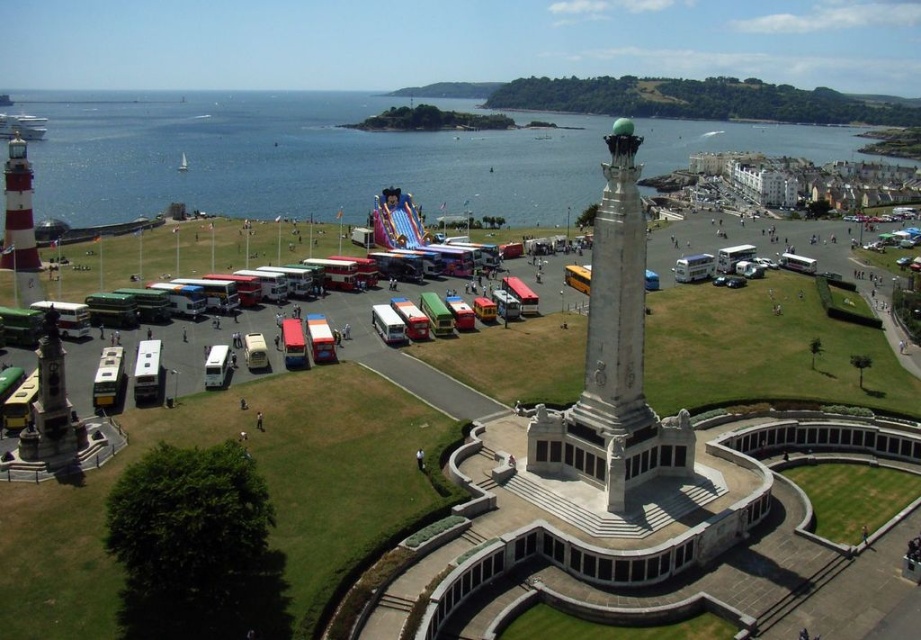
Question: Is white marble monument at center positioned behind polished stone monument at lower left?

Choices:
 (A) yes
 (B) no

Answer: (B)

Question: Does blue water at upper center have a greater width compared to white painted lighthouse at left?

Choices:
 (A) no
 (B) yes

Answer: (B)

Question: Is blue water at upper center in front of polished stone monument at lower left?

Choices:
 (A) no
 (B) yes

Answer: (A)

Question: Among these objects, which one is farthest from the camera?

Choices:
 (A) white painted lighthouse at left
 (B) blue water at upper center
 (C) white marble monument at center
 (D) polished stone monument at lower left

Answer: (A)

Question: Which of the following is the closest to the observer?

Choices:
 (A) blue water at upper center
 (B) white painted lighthouse at left

Answer: (A)

Question: Which point is closer to the camera?

Choices:
 (A) (65, 422)
 (B) (6, 182)

Answer: (A)